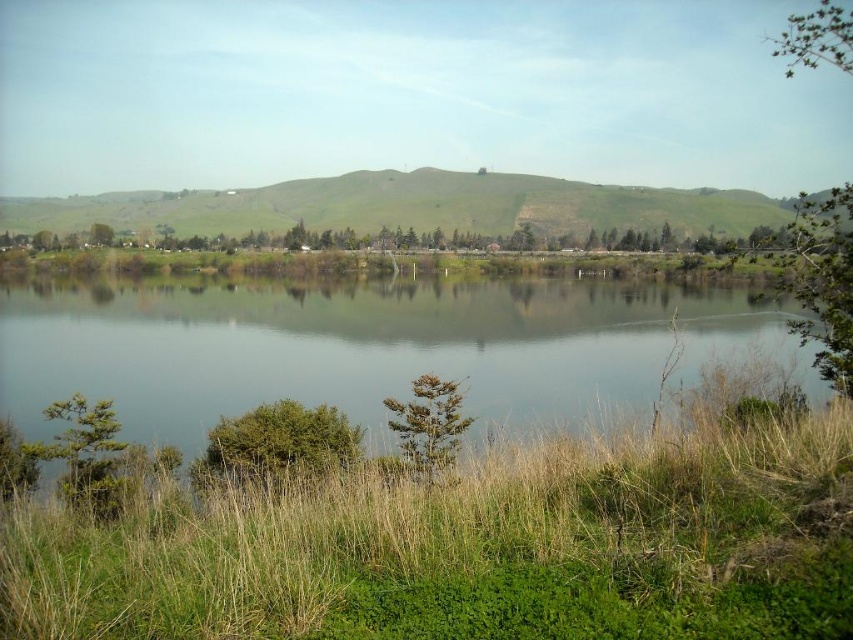
Does point (126, 570) come closer to viewer compared to point (345, 348)?

That is True.

Is point (717, 445) closer to viewer compared to point (51, 369)?

Yes, point (717, 445) is closer to viewer.

This screenshot has height=640, width=853. I want to click on green grass at lower center, so click(x=468, y=536).